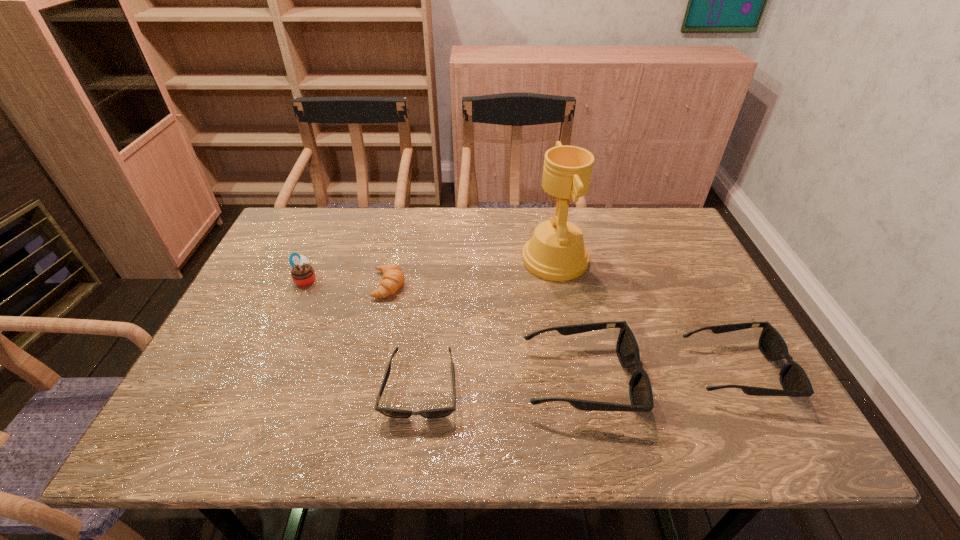
Identify the location of unoccupied position between the second sunglasses from right to left and the crescent roll. (485, 332).

Find the location of `vacant area between the second tallest object and the shortest sunglasses`. vacant area between the second tallest object and the shortest sunglasses is located at coordinates (364, 334).

Select which object appears as the third closest to the award. Please provide its 2D coordinates. Your answer should be formatted as a tuple, i.e. [(x, y)], where the tuple contains the x and y coordinates of a point satisfying the conditions above.

[(389, 412)]

Identify which object is located as the fifth nearest to the fifth shortest object. Please provide its 2D coordinates. Your answer should be formatted as a tuple, i.e. [(x, y)], where the tuple contains the x and y coordinates of a point satisfying the conditions above.

[(795, 383)]

Select which sunglasses appears as the closest to the muffin. Please provide its 2D coordinates. Your answer should be formatted as a tuple, i.e. [(x, y)], where the tuple contains the x and y coordinates of a point satisfying the conditions above.

[(389, 412)]

At what (x,y) coordinates should I click in order to perform the action: click on sunglasses that stands as the second closest to the tallest object. Please return your answer as a coordinate pair (x, y). Looking at the image, I should click on coord(795,383).

Where is `free space that satisfies the following two spatial constraints: 1. on the back side of the crescent roll; 2. on the front-facing side of the muffin`? This screenshot has height=540, width=960. free space that satisfies the following two spatial constraints: 1. on the back side of the crescent roll; 2. on the front-facing side of the muffin is located at coordinates tap(391, 280).